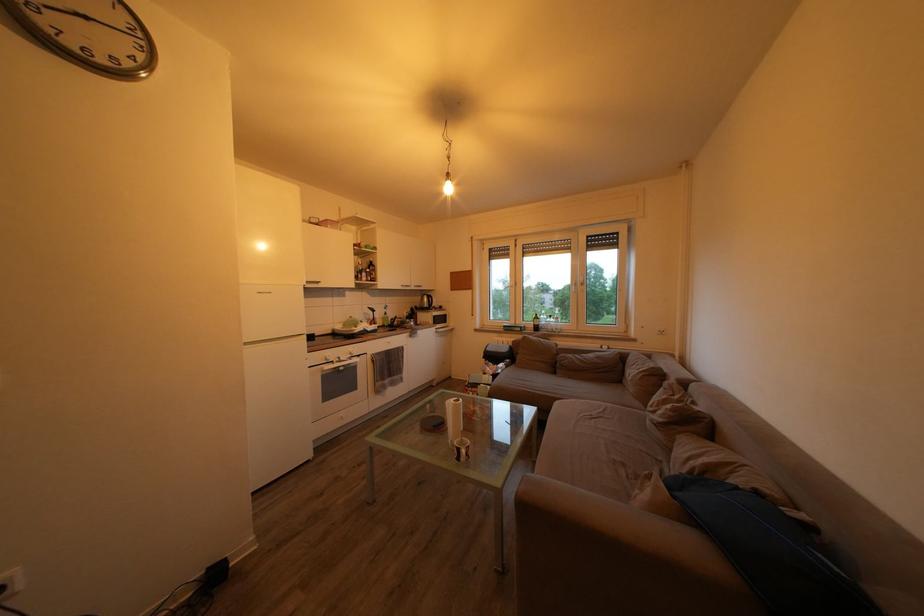
Where is `sofa sitting surface`? Image resolution: width=924 pixels, height=616 pixels. sofa sitting surface is located at coordinates (616, 440).